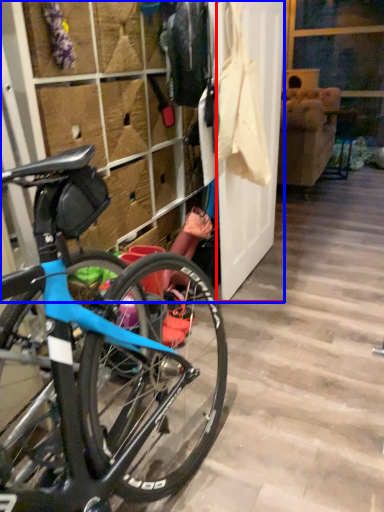
Question: Which object is further to the camera taking this photo, screen door (highlighted by a red box) or closet (highlighted by a blue box)?

Choices:
 (A) screen door
 (B) closet

Answer: (A)